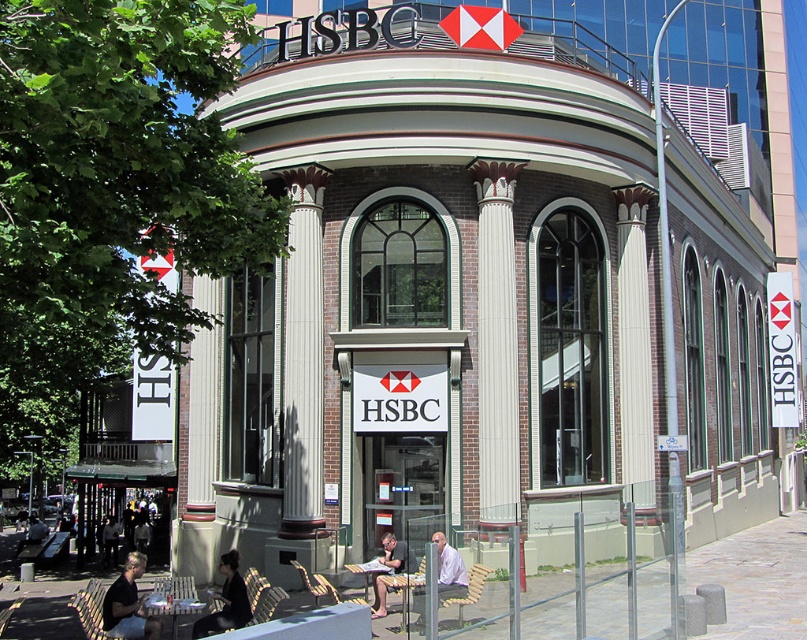
You are a customer waiting at the HSBC bank branch. You see the white textured column at center and the dark gray shirt at lower left. Which object is closer to you?

The dark gray shirt at lower left is closer to you because the white textured column at center is positioned over it, indicating it is further away.

You are standing in front of the HSBC bank branch and need to locate the white textured column at center. According to the architectural layout, where would you find it in relation to the entrance?

The white textured column at center is located at point 0.555 on the x axis and 0.787 on the y axis, so it is positioned to the right and slightly below the entrance based on the coordinate system provided.